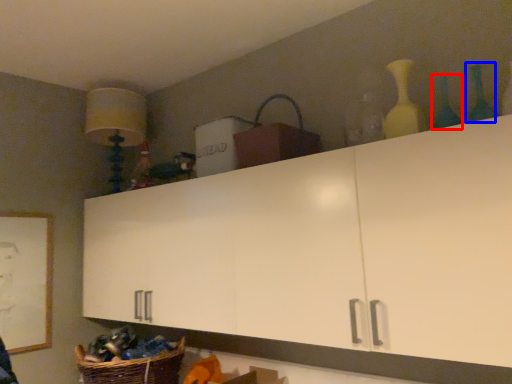
Question: Which object appears closest to the camera in this image, bottle (highlighted by a red box) or bottle (highlighted by a blue box)?

Choices:
 (A) bottle
 (B) bottle

Answer: (B)